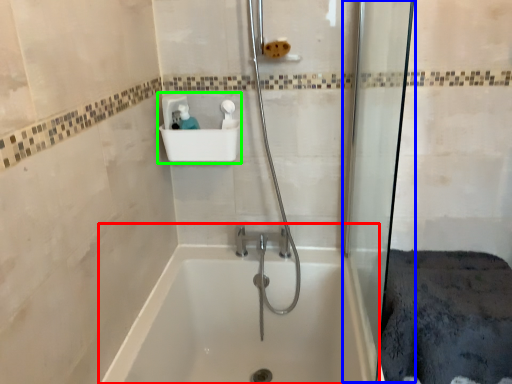
Question: Which is nearer to the bathtub (highlighted by a red box)? shower door (highlighted by a blue box) or sink (highlighted by a green box).

Choices:
 (A) shower door
 (B) sink

Answer: (A)